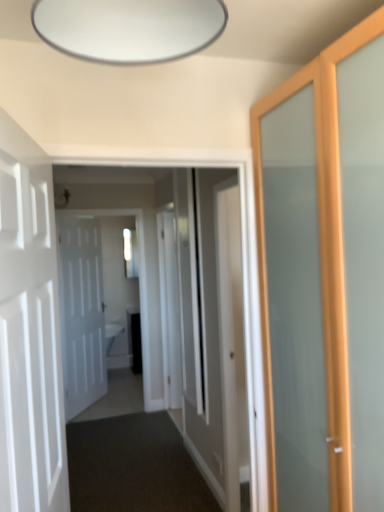
Question: Is white matte door at left, the 2th door viewed from the right, with white matte door at left, the first door positioned from the left?

Choices:
 (A) no
 (B) yes

Answer: (A)

Question: Is white matte door at left, which is the 3th door in back-to-front order, completely or partially outside of white matte door at left, which appears as the third door when viewed from the right?

Choices:
 (A) no
 (B) yes

Answer: (B)

Question: From the image's perspective, does white matte door at left, the 2th door viewed from the right, appear higher than white matte door at left, which appears as the third door when viewed from the front?

Choices:
 (A) no
 (B) yes

Answer: (B)

Question: Does white matte door at left, which is the 3th door in back-to-front order, have a smaller size compared to white matte door at left, which appears as the third door when viewed from the front?

Choices:
 (A) no
 (B) yes

Answer: (A)

Question: Is white matte door at left, the first door when ordered from front to back, at the left side of white matte door at left, which appears as the third door when viewed from the front?

Choices:
 (A) no
 (B) yes

Answer: (A)

Question: Does white matte door at left, the first door when ordered from front to back, have a greater height compared to white matte door at left, the first door positioned from the left?

Choices:
 (A) no
 (B) yes

Answer: (A)

Question: From a real-world perspective, is white matte door at left, which is the 3th door in back-to-front order, physically above white glossy door at center, the 3th door positioned from the left?

Choices:
 (A) no
 (B) yes

Answer: (B)

Question: Is white matte door at left, which is the 3th door in back-to-front order, positioned in front of white glossy door at center, which is the 1th door in right-to-left order?

Choices:
 (A) yes
 (B) no

Answer: (A)

Question: Is white matte door at left, which is the 3th door in back-to-front order, directly adjacent to white glossy door at center, the 3th door positioned from the left?

Choices:
 (A) yes
 (B) no

Answer: (B)

Question: Does white matte door at left, the 2th door in the left-to-right sequence, have a greater height compared to white glossy door at center, which is the 1th door in right-to-left order?

Choices:
 (A) no
 (B) yes

Answer: (A)

Question: From the image's perspective, would you say white matte door at left, which is the 3th door in back-to-front order, is shown under white glossy door at center, the second door from the back?

Choices:
 (A) no
 (B) yes

Answer: (A)

Question: Does white matte door at left, which is the 3th door in back-to-front order, turn towards white glossy door at center, which is the 1th door in right-to-left order?

Choices:
 (A) no
 (B) yes

Answer: (A)

Question: Is dark carpet at center, marked as the 1th path in a front-to-back arrangement, directly adjacent to white glossy door at center, positioned as the first path in back-to-front order?

Choices:
 (A) no
 (B) yes

Answer: (A)